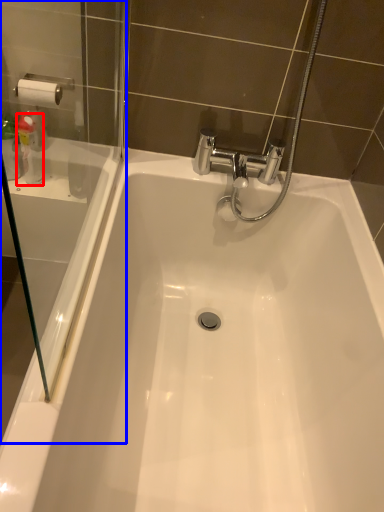
Question: Which point is closer to the camera, cleaning product (highlighted by a red box) or screen door (highlighted by a blue box)?

Choices:
 (A) cleaning product
 (B) screen door

Answer: (B)